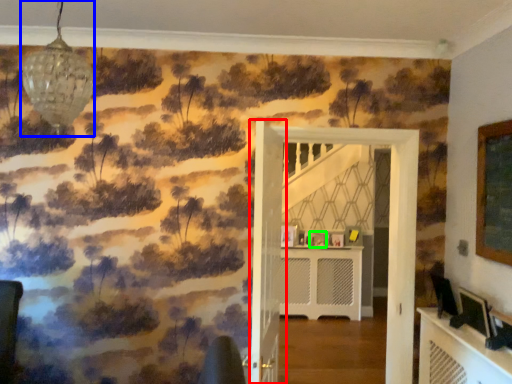
Question: Based on their relative distances, which object is farther from door (highlighted by a red box)? Choose from light fixture (highlighted by a blue box) and picture frame (highlighted by a green box).

Choices:
 (A) light fixture
 (B) picture frame

Answer: (B)